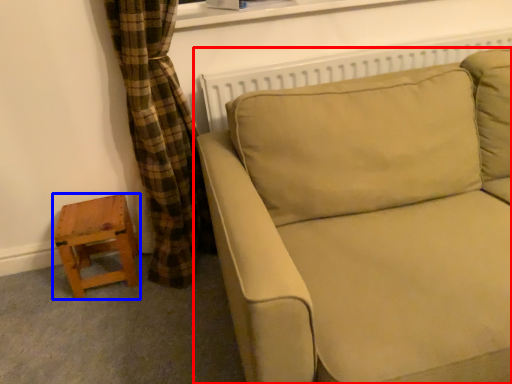
Question: Which object appears closest to the camera in this image, studio couch (highlighted by a red box) or stool (highlighted by a blue box)?

Choices:
 (A) studio couch
 (B) stool

Answer: (A)